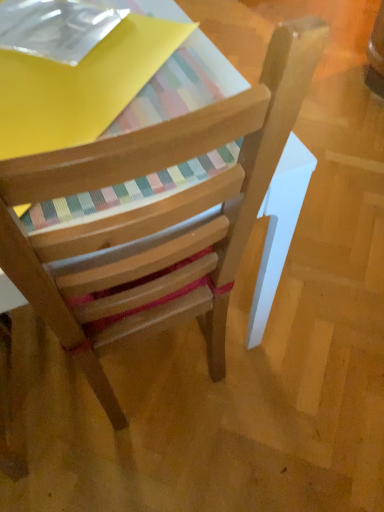
Question: Is wooden chair at center closer to camera compared to transparent plastic paperback book at upper left?

Choices:
 (A) no
 (B) yes

Answer: (B)

Question: Considering the relative sizes of wooden chair at center and transparent plastic paperback book at upper left in the image provided, is wooden chair at center smaller than transparent plastic paperback book at upper left?

Choices:
 (A) no
 (B) yes

Answer: (A)

Question: Is wooden chair at center oriented towards transparent plastic paperback book at upper left?

Choices:
 (A) no
 (B) yes

Answer: (A)

Question: Is wooden chair at center shorter than transparent plastic paperback book at upper left?

Choices:
 (A) yes
 (B) no

Answer: (B)

Question: From a real-world perspective, is wooden chair at center over transparent plastic paperback book at upper left?

Choices:
 (A) no
 (B) yes

Answer: (A)

Question: Is wooden chair at center taller than transparent plastic paperback book at upper left?

Choices:
 (A) no
 (B) yes

Answer: (B)

Question: Does transparent plastic paperback book at upper left turn towards wooden chair at center?

Choices:
 (A) no
 (B) yes

Answer: (A)

Question: Considering the relative sizes of transparent plastic paperback book at upper left and wooden chair at center in the image provided, is transparent plastic paperback book at upper left wider than wooden chair at center?

Choices:
 (A) yes
 (B) no

Answer: (B)

Question: Could wooden chair at center be considered to be inside transparent plastic paperback book at upper left?

Choices:
 (A) no
 (B) yes

Answer: (A)

Question: Can you confirm if transparent plastic paperback book at upper left is shorter than wooden chair at center?

Choices:
 (A) yes
 (B) no

Answer: (A)

Question: Can you confirm if transparent plastic paperback book at upper left is smaller than wooden chair at center?

Choices:
 (A) no
 (B) yes

Answer: (B)

Question: From the image's perspective, is transparent plastic paperback book at upper left over wooden chair at center?

Choices:
 (A) no
 (B) yes

Answer: (B)

Question: Relative to wooden chair at center, is transparent plastic paperback book at upper left in front or behind?

Choices:
 (A) front
 (B) behind

Answer: (B)